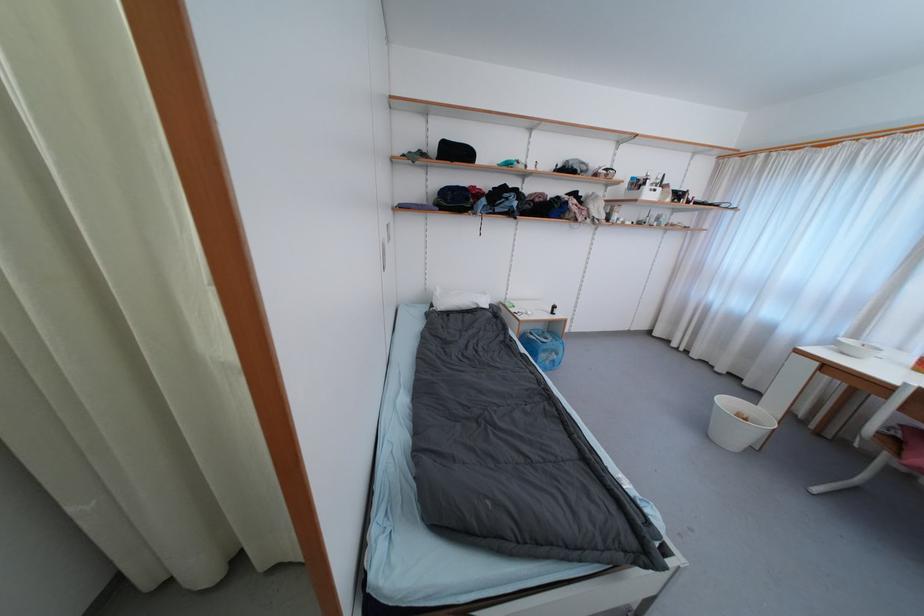
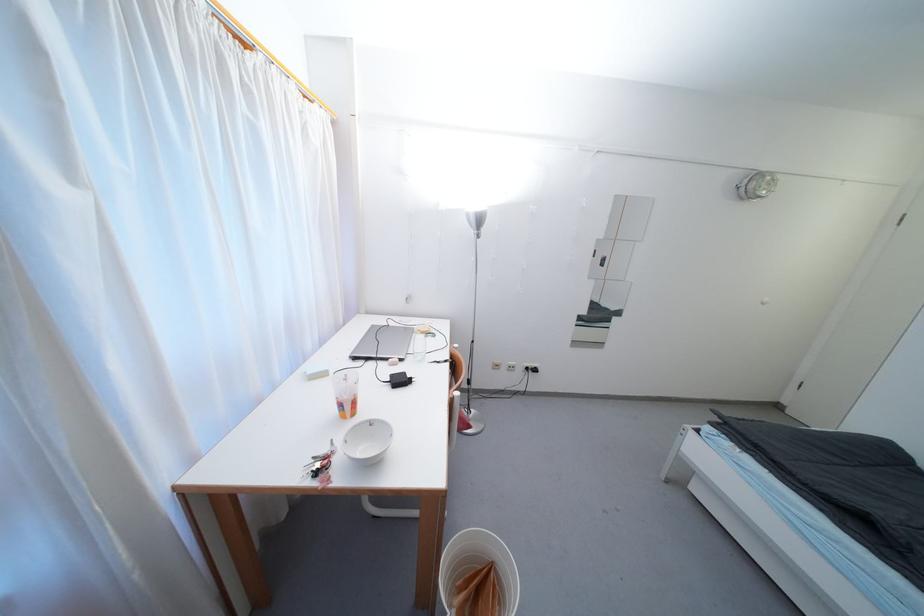
Question: I am providing you with two images of the same scene from different viewpoints. Please identify which objects are invisible in image2.

Choices:
 (A) chair sitting surface
 (B) white electrical outlet
 (C) suitcase carrying handle
 (D) black power adapter

Answer: (A)